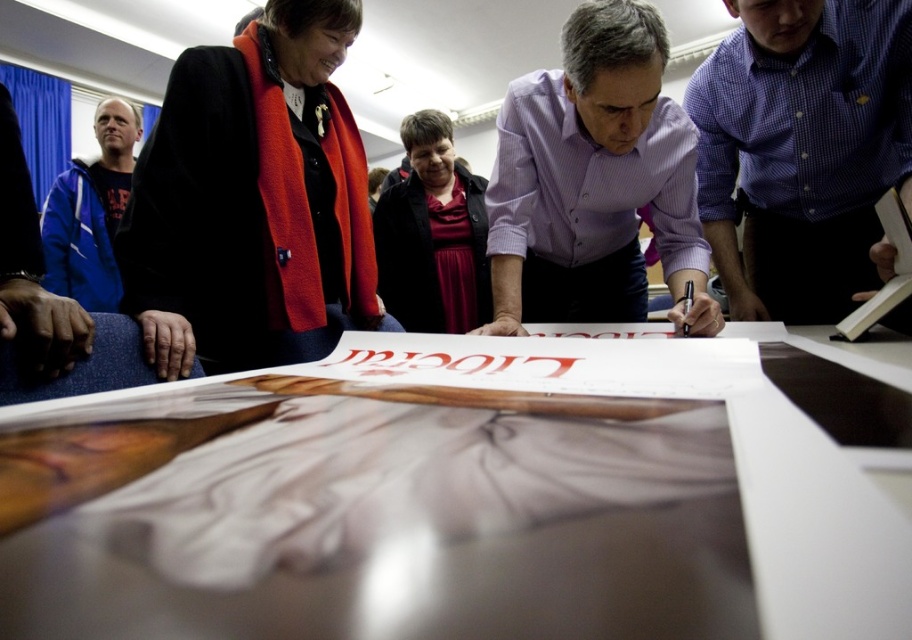
Question: Based on their relative distances, which object is nearer to the matte red text at center?

Choices:
 (A) black paper at center
 (B) white glossy table at center
 (C) purple striped shirt at center
 (D) purple checkered shirt at upper right

Answer: (B)

Question: Does matte red dress at center come in front of matte red text at center?

Choices:
 (A) no
 (B) yes

Answer: (A)

Question: Is purple checkered shirt at upper right above purple striped shirt at center?

Choices:
 (A) yes
 (B) no

Answer: (A)

Question: Which of the following is the farthest from the observer?

Choices:
 (A) white glossy table at center
 (B) black paper at center
 (C) black woolen coat at upper left
 (D) blue fleece jacket at left

Answer: (D)

Question: From the image, what is the correct spatial relationship of purple striped shirt at center in relation to matte red dress at center?

Choices:
 (A) below
 (B) above

Answer: (A)

Question: Which point is farther to the camera?

Choices:
 (A) white glossy table at center
 (B) purple striped shirt at center
 (C) black paper at center

Answer: (C)